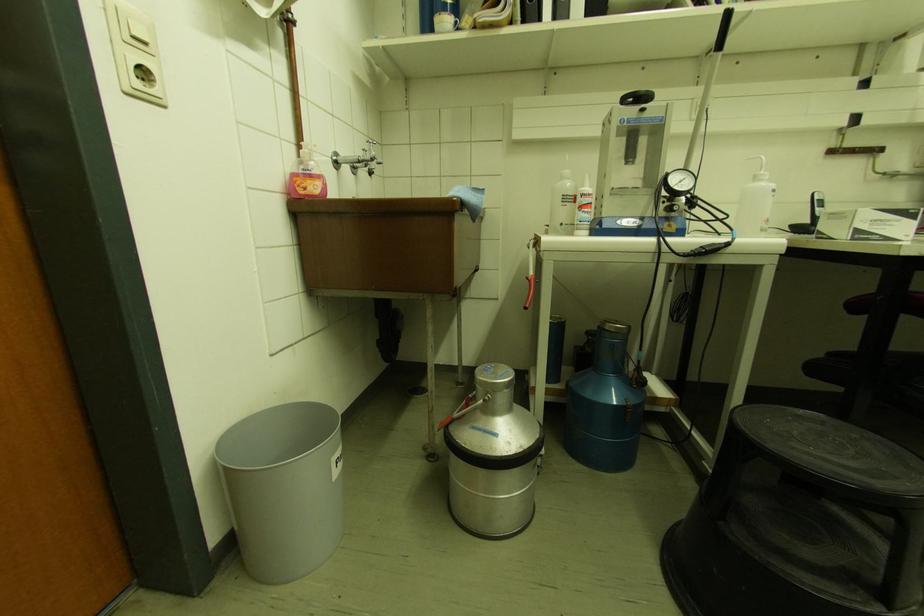
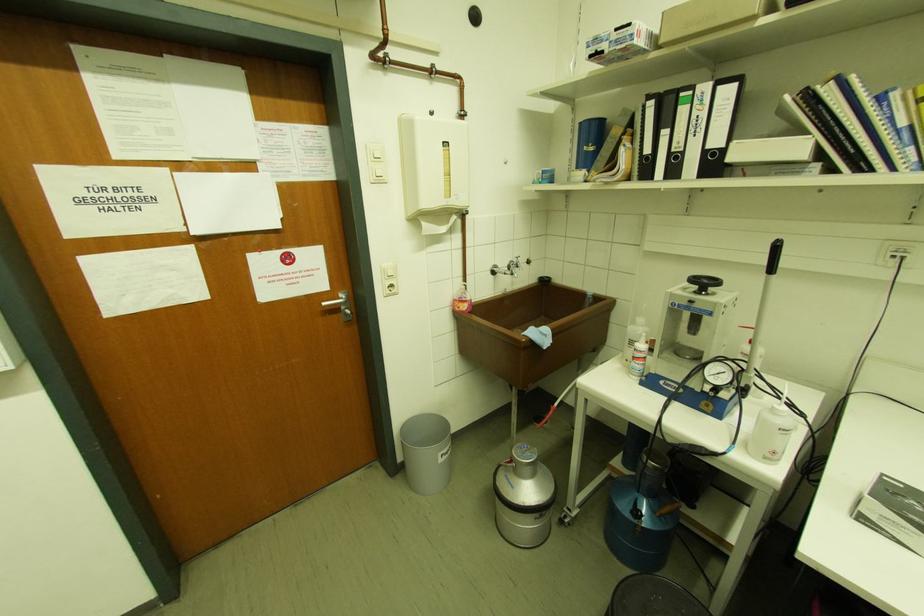
Locate, in the second image, the point that corresponds to point (565, 225) in the first image.

(629, 362)